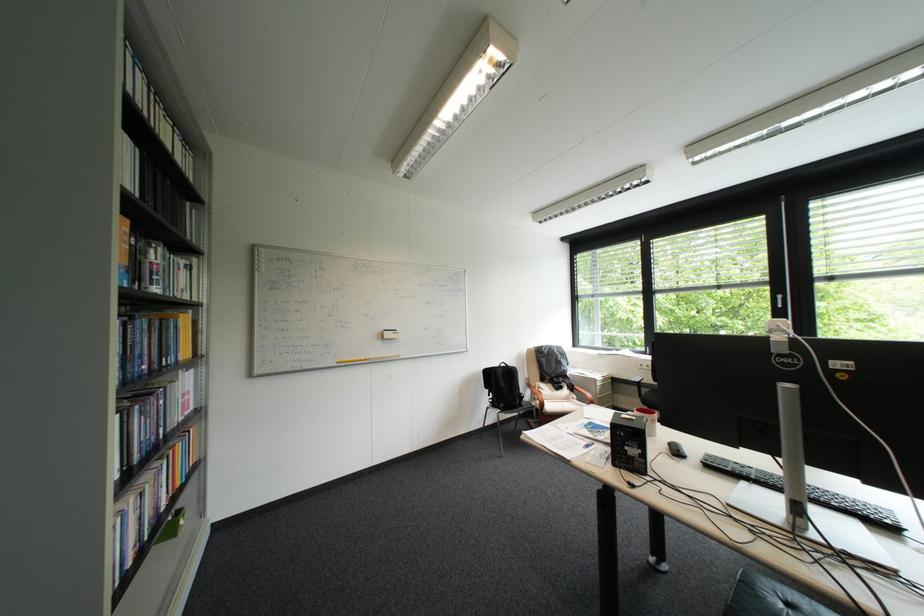
In order to click on red mug in this screenshot , I will do `click(648, 419)`.